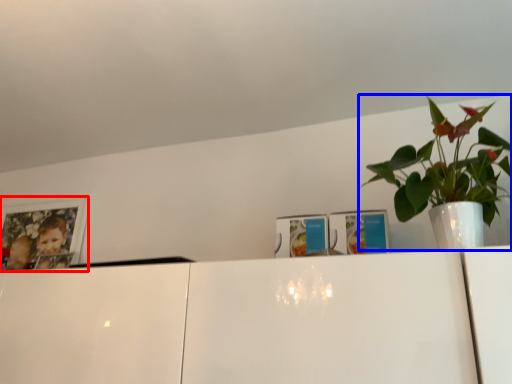
Question: Which of the following is the farthest to the observer, picture frame (highlighted by a red box) or houseplant (highlighted by a blue box)?

Choices:
 (A) picture frame
 (B) houseplant

Answer: (A)